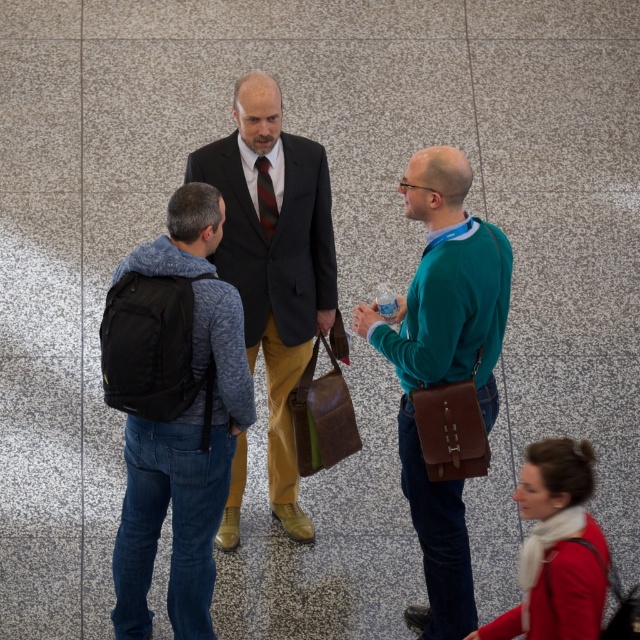
You are attending a conference and see two items of clothing in the scene. The matte black suit at center and the striped silk tie at center. Which one is positioned to the right side?

The striped silk tie at center is positioned to the right of the matte black suit at center.